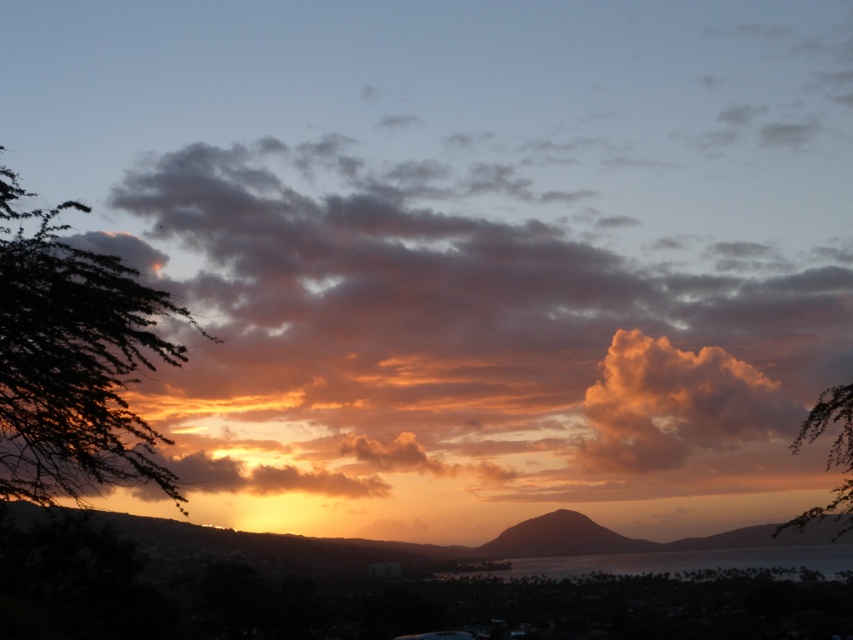
Question: Which point is closer to the camera?

Choices:
 (A) (556, 573)
 (B) (140, 260)
 (C) (33, 404)
 (D) (753, 435)

Answer: (C)

Question: Is silky black branches at left above orange cotton cloud at upper right?

Choices:
 (A) yes
 (B) no

Answer: (A)

Question: Which object appears farthest from the camera in this image?

Choices:
 (A) silky black branches at left
 (B) matte orange cloud at upper left
 (C) orange cotton cloud at upper right

Answer: (C)

Question: Can you confirm if silky black branches at left is thinner than green leafy branch at right?

Choices:
 (A) yes
 (B) no

Answer: (B)

Question: Among these objects, which one is farthest from the camera?

Choices:
 (A) silky black branches at left
 (B) translucent glass water at lower center

Answer: (B)

Question: Is translucent glass water at lower center bigger than matte orange cloud at upper left?

Choices:
 (A) yes
 (B) no

Answer: (B)